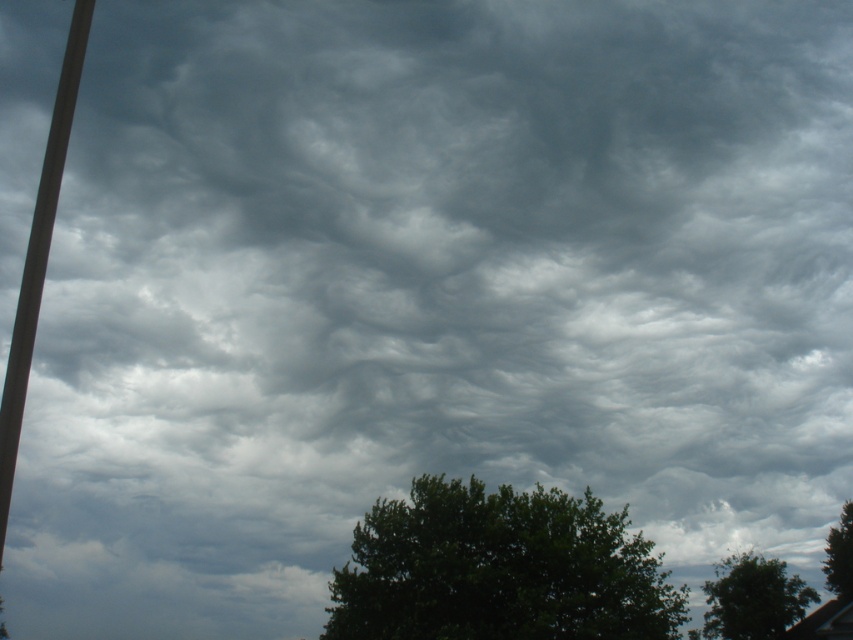
Question: Can you confirm if dark green leafy tree at center is positioned to the left of smooth gray pole at left?

Choices:
 (A) no
 (B) yes

Answer: (A)

Question: Is dark green leafy tree at center smaller than smooth gray pole at left?

Choices:
 (A) yes
 (B) no

Answer: (A)

Question: Which object appears farthest from the camera in this image?

Choices:
 (A) dark green leafy tree at center
 (B) smooth gray pole at left

Answer: (A)

Question: Does dark green leafy tree at center appear on the right side of smooth gray pole at left?

Choices:
 (A) no
 (B) yes

Answer: (B)

Question: Which object appears farthest from the camera in this image?

Choices:
 (A) dark green leafy tree at center
 (B) smooth gray pole at left

Answer: (A)

Question: Which of the following is the farthest from the observer?

Choices:
 (A) dark green leafy tree at center
 (B) smooth gray pole at left

Answer: (A)